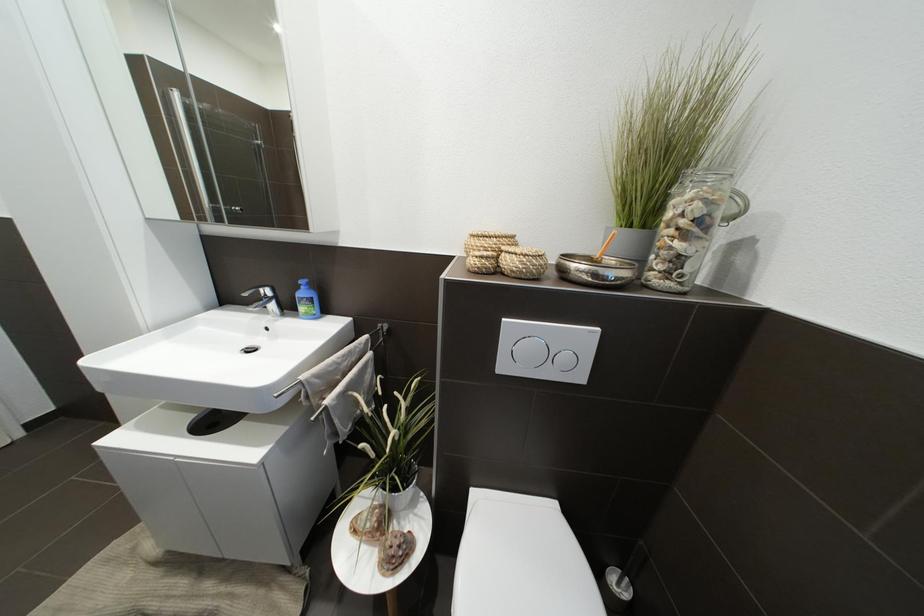
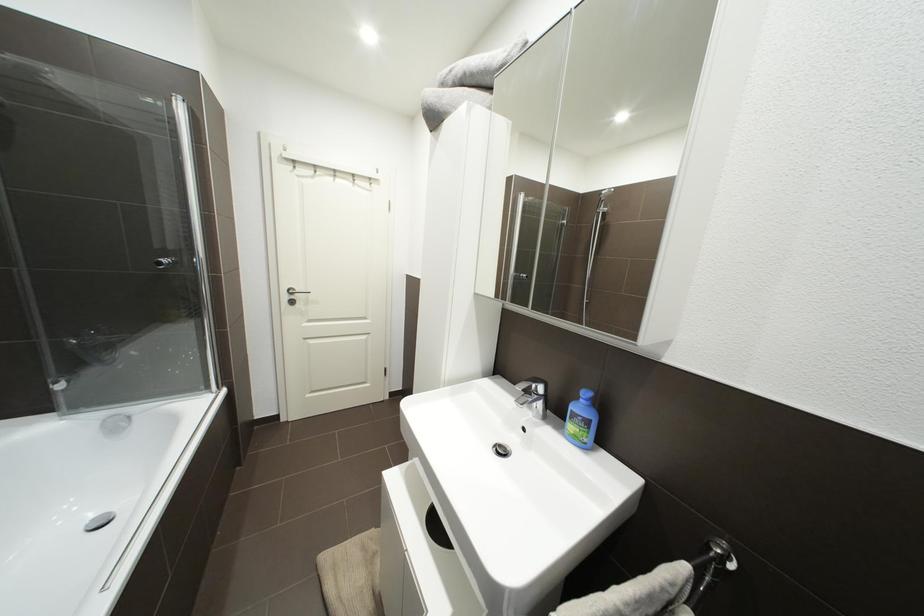
Question: The images are taken continuously from a first-person perspective. In which direction is your viewpoint rotating?

Choices:
 (A) Left
 (B) Right
 (C) Up
 (D) Down

Answer: (A)